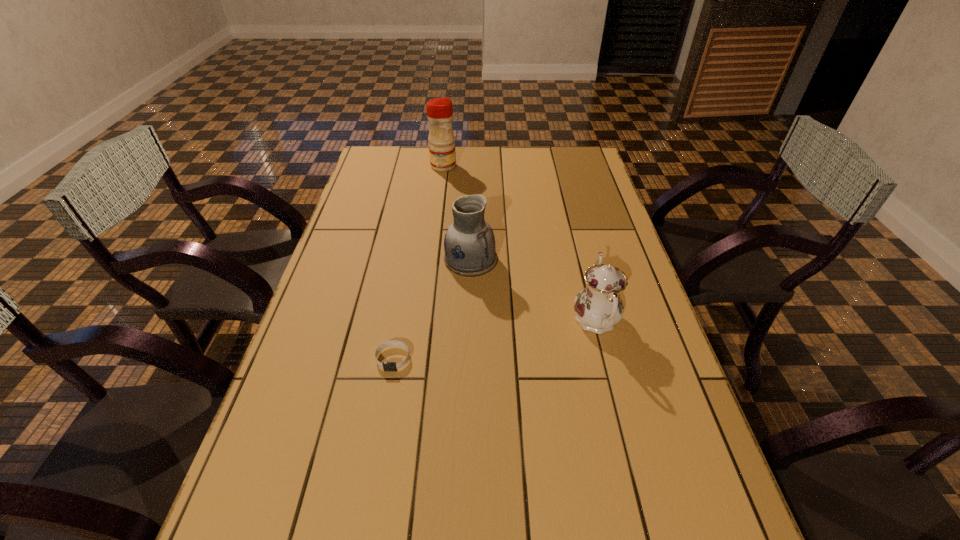
Locate an element on the screen. This screenshot has height=540, width=960. condiment is located at coordinates (441, 139).

The height and width of the screenshot is (540, 960). I want to click on the tallest object, so click(x=441, y=139).

Locate an element on the screen. The image size is (960, 540). pottery is located at coordinates (469, 244).

The width and height of the screenshot is (960, 540). Find the location of `the rightmost object`. the rightmost object is located at coordinates (598, 307).

I want to click on the shortest object, so click(387, 366).

Find the location of a particular element. This screenshot has width=960, height=540. free space located on the front of the condiment is located at coordinates (438, 211).

Locate an element on the screen. This screenshot has height=540, width=960. vacant space situated 0.080m on the right of the pottery is located at coordinates (524, 260).

I want to click on free spot located on the front of the chinaware, so click(x=610, y=374).

Locate an element on the screen. Image resolution: width=960 pixels, height=540 pixels. vacant area situated 0.180m on the outer surface of the shortest object is located at coordinates (378, 444).

Where is `object that is at the far edge`? This screenshot has width=960, height=540. object that is at the far edge is located at coordinates (441, 139).